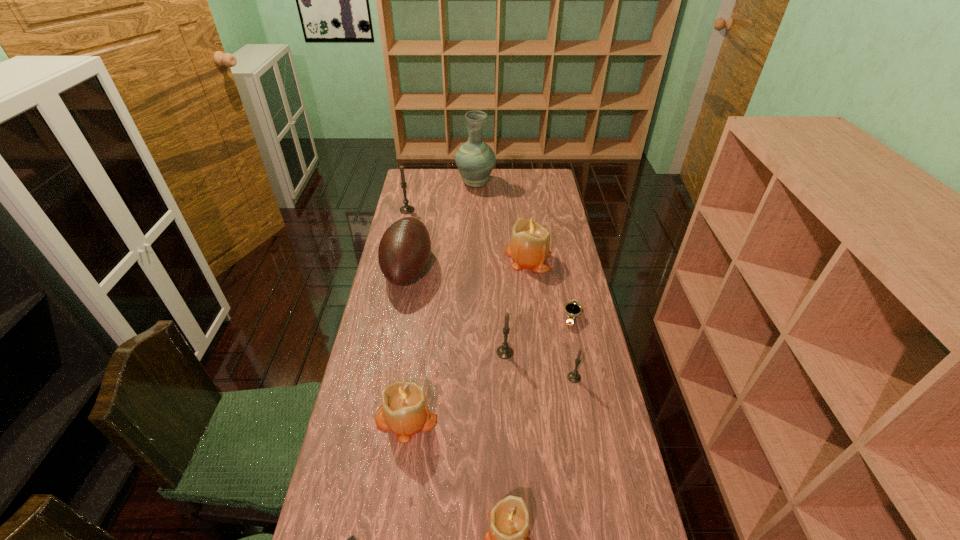
Identify the location of free space located on the back of the smallest gray candle. The image size is (960, 540). (557, 284).

You are a GUI agent. You are given a task and a screenshot of the screen. Output one action in this format:
    pyautogui.click(x=<x>, y=<y>)
    Task: Click on the free location located 0.120m on the left of the ninth tallest object
    The height and width of the screenshot is (540, 960).
    Given the screenshot: What is the action you would take?
    pyautogui.click(x=527, y=317)

Find the location of `object that is at the far edge`. object that is at the far edge is located at coordinates (475, 160).

You are a GUI agent. You are given a task and a screenshot of the screen. Output one action in this format:
    pyautogui.click(x=<x>, y=<y>)
    Task: Click on the football (American) that is positioned at the left edge
    This screenshot has width=960, height=540.
    Given the screenshot: What is the action you would take?
    pyautogui.click(x=404, y=250)

Locate an element on the screen. watch that is at the right edge is located at coordinates (572, 309).

Locate an element on the screen. The height and width of the screenshot is (540, 960). vacant region at the far edge of the desktop is located at coordinates (457, 176).

In the image, there is a desktop. Where is `vacant space at the left edge`? The height and width of the screenshot is (540, 960). vacant space at the left edge is located at coordinates (387, 441).

This screenshot has height=540, width=960. In the image, there is a desktop. In order to click on vacant space at the right edge in this screenshot , I will do `click(575, 396)`.

In order to click on vacant space at the far left corner in this screenshot , I will do `click(428, 174)`.

Where is `vacant space in between the leftmost gray candle and the second gray candle from left to right`? vacant space in between the leftmost gray candle and the second gray candle from left to right is located at coordinates (456, 281).